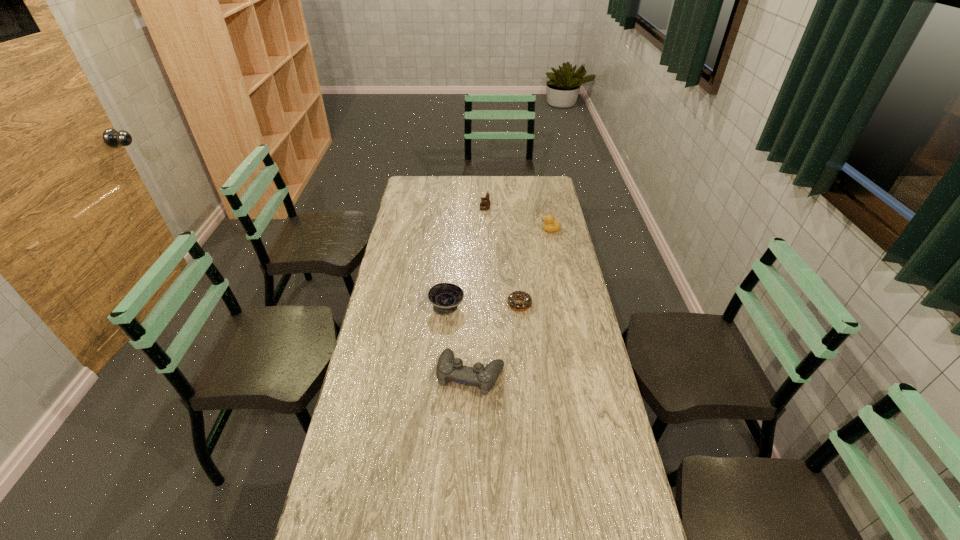
In order to click on teddy bear in this screenshot , I will do `click(485, 201)`.

I want to click on duckling, so click(549, 225).

Image resolution: width=960 pixels, height=540 pixels. What are the coordinates of `the rightmost object` in the screenshot? It's located at (549, 225).

Find the location of a particular element. The width and height of the screenshot is (960, 540). the nearest object is located at coordinates (449, 368).

Where is `bowl`? The image size is (960, 540). bowl is located at coordinates (445, 297).

The image size is (960, 540). In order to click on the fourth object from left to right in this screenshot , I will do `click(518, 306)`.

Locate an element on the screen. This screenshot has width=960, height=540. doughnut is located at coordinates (x=518, y=306).

Identify the location of vacant region located 0.170m on the face of the teddy bear. The image size is (960, 540). (446, 208).

At what (x,y) coordinates should I click in order to perform the action: click on free space located 0.060m on the face of the teddy bear. Please return your answer as a coordinate pair (x, y). This screenshot has width=960, height=540. Looking at the image, I should click on (468, 208).

The width and height of the screenshot is (960, 540). Find the location of `vacant space situated on the face of the teddy bear`. vacant space situated on the face of the teddy bear is located at coordinates (454, 208).